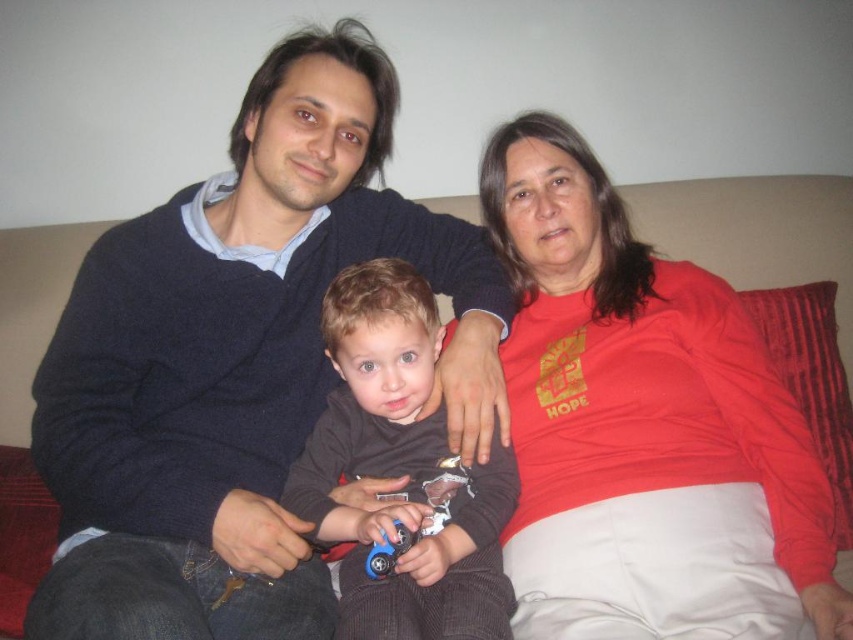
Question: Which point is closer to the camera?

Choices:
 (A) pyautogui.click(x=844, y=280)
 (B) pyautogui.click(x=567, y=198)

Answer: (B)

Question: Does dark brown corduroy pants at center have a smaller size compared to suede-like beige couch at center?

Choices:
 (A) yes
 (B) no

Answer: (A)

Question: Which point appears closest to the camera in this image?

Choices:
 (A) (79, 532)
 (B) (722, 600)
 (C) (387, 564)
 (D) (15, 509)

Answer: (B)

Question: Does matte dark blue sweater at center have a greater width compared to dark brown corduroy pants at center?

Choices:
 (A) no
 (B) yes

Answer: (B)

Question: Which object appears farthest from the camera in this image?

Choices:
 (A) dark brown corduroy pants at center
 (B) matte dark blue sweater at center
 (C) suede-like beige couch at center
 (D) red matte shirt at center

Answer: (C)

Question: Is matte dark blue sweater at center further to camera compared to dark brown corduroy pants at center?

Choices:
 (A) yes
 (B) no

Answer: (B)